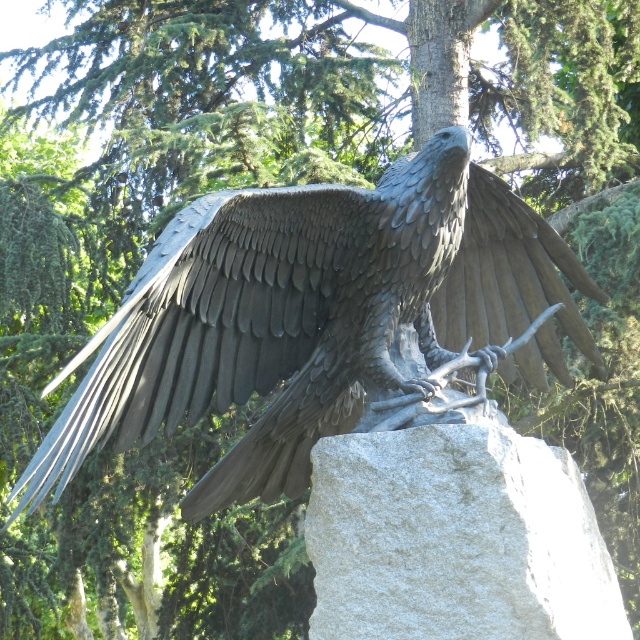
Which is behind, point (312, 192) or point (413, 492)?

Point (312, 192)

Between point (384, 333) and point (365, 456), which one is positioned in front?

Point (365, 456) is more forward.

Describe the element at coordinates (308, 314) in the screenshot. I see `polished bronze eagle at center` at that location.

Find the location of a particular element. The image size is (640, 640). polished bronze eagle at center is located at coordinates [308, 314].